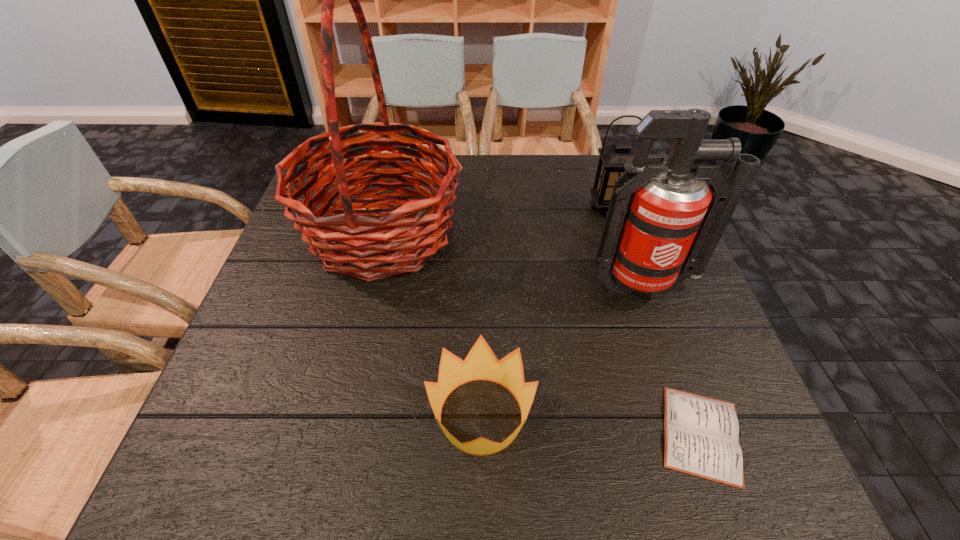
Where is `basket at the far edge`? This screenshot has width=960, height=540. basket at the far edge is located at coordinates (354, 243).

Identify the location of lantern positioned at the far edge. (613, 157).

You are a GUI agent. You are given a task and a screenshot of the screen. Output one action in this format:
    pyautogui.click(x=<x>, y=<y>)
    Task: Click on the crown present at the near edge
    
    Given the screenshot: What is the action you would take?
    480,364

Locate an element on the screen. Image resolution: width=960 pixels, height=540 pixels. diary situated at the near edge is located at coordinates (701, 434).

This screenshot has width=960, height=540. Find the location of `object present at the left edge`. object present at the left edge is located at coordinates (354, 243).

Image resolution: width=960 pixels, height=540 pixels. In order to click on fire extinguisher located in the right edge section of the desktop in this screenshot , I will do `click(663, 225)`.

At what (x,y) coordinates should I click in order to perform the action: click on lantern present at the right edge. Please return your answer as a coordinate pair (x, y). This screenshot has width=960, height=540. Looking at the image, I should click on (613, 157).

You are a GUI agent. You are given a task and a screenshot of the screen. Output one action in this format:
    pyautogui.click(x=<x>, y=<y>)
    Task: Click on the diary that is positioned at the right edge
    This screenshot has height=540, width=960.
    Given the screenshot: What is the action you would take?
    pyautogui.click(x=701, y=434)

Identify the location of object that is at the far left corner. Image resolution: width=960 pixels, height=540 pixels. (354, 243).

This screenshot has width=960, height=540. Identify the location of object present at the far right corner. 613,157.